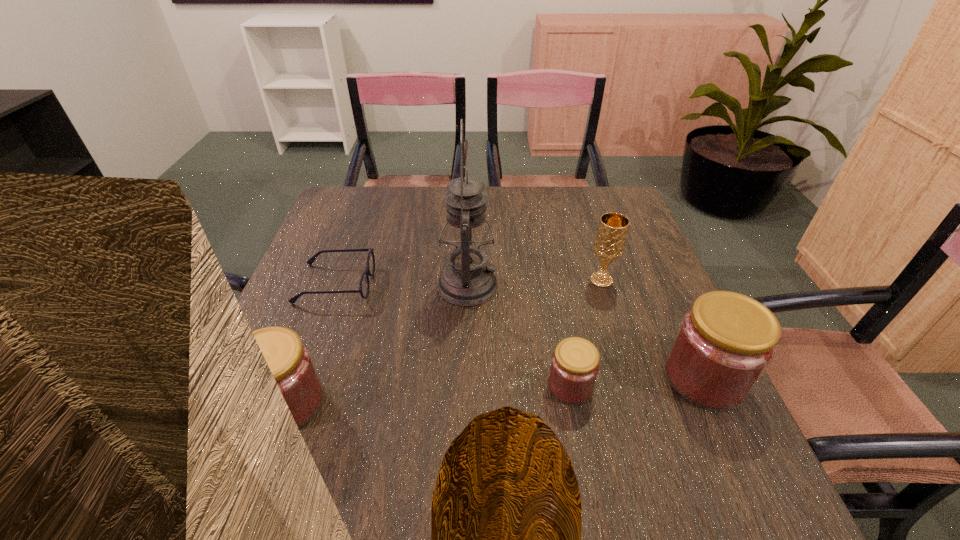
The height and width of the screenshot is (540, 960). Find the location of `blank space located 0.210m on the back of the second jam from left to right`. blank space located 0.210m on the back of the second jam from left to right is located at coordinates (554, 296).

You are a GUI agent. You are given a task and a screenshot of the screen. Output one action in this format:
    pyautogui.click(x=<x>, y=<y>)
    Task: Click on the free region located on the left of the rightmost object
    The image size is (960, 540).
    Given the screenshot: What is the action you would take?
    pyautogui.click(x=569, y=378)

Identify the location of vacant space located 0.350m on the front-facing side of the spectacles. The width and height of the screenshot is (960, 540). (513, 284).

In order to click on free space located on the back of the chalice in this screenshot , I will do `click(590, 248)`.

You are a GUI agent. You are given a task and a screenshot of the screen. Output one action in this format:
    pyautogui.click(x=<x>, y=<y>)
    Task: Click on the free space located 0.070m on the right of the oil lamp
    This screenshot has width=960, height=540.
    Given the screenshot: What is the action you would take?
    pyautogui.click(x=526, y=286)

The image size is (960, 540). I want to click on jam that is at the left edge, so click(290, 360).

What are the coordinates of `spectacles that is at the left edge` in the screenshot? It's located at (364, 286).

Where is `jam that is at the right edge`? The height and width of the screenshot is (540, 960). jam that is at the right edge is located at coordinates (724, 344).

This screenshot has height=540, width=960. I want to click on chalice present at the right edge, so click(x=610, y=239).

This screenshot has width=960, height=540. I want to click on object at the near left corner, so pos(290,360).